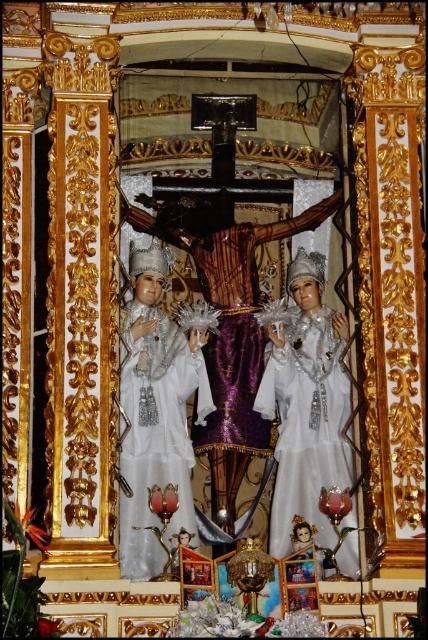
Question: Is white glossy statue at center to the left of white satin dress at center from the viewer's perspective?

Choices:
 (A) yes
 (B) no

Answer: (A)

Question: Which object is farther from the camera taking this photo?

Choices:
 (A) white glossy statue at center
 (B) white satin dress at center

Answer: (B)

Question: Is white glossy statue at center further to the viewer compared to white satin dress at center?

Choices:
 (A) no
 (B) yes

Answer: (A)

Question: Does white glossy statue at center appear on the left side of white satin dress at center?

Choices:
 (A) yes
 (B) no

Answer: (A)

Question: Among these points, which one is farthest from the camera?

Choices:
 (A) (134, 362)
 (B) (290, 378)

Answer: (B)